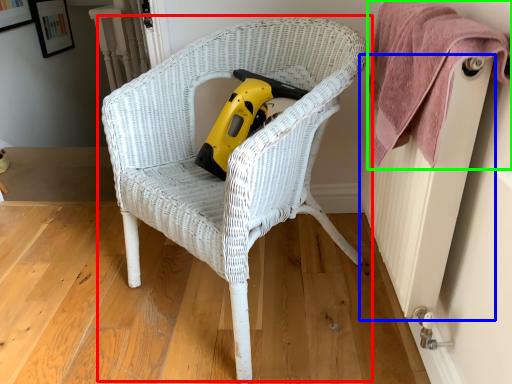
Question: Which object is the farthest from chair (highlighted by a red box)? Choose among these: radiator (highlighted by a blue box) or towel (highlighted by a green box).

Choices:
 (A) radiator
 (B) towel

Answer: (A)